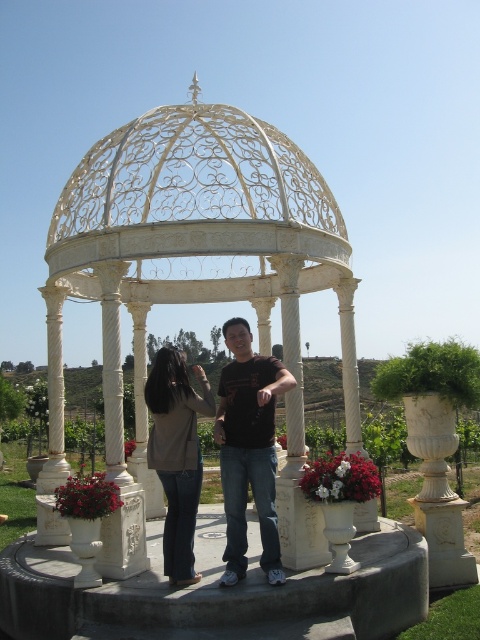
Question: Based on their relative distances, which object is nearer to the white marble gazebo at center?

Choices:
 (A) dark brown t-shirt at center
 (B) matte beige jacket at center

Answer: (A)

Question: Does white marble gazebo at center appear on the left side of matte beige jacket at center?

Choices:
 (A) yes
 (B) no

Answer: (A)

Question: Does white marble gazebo at center appear on the right side of matte beige jacket at center?

Choices:
 (A) no
 (B) yes

Answer: (A)

Question: Which point appears closest to the camera in this image?

Choices:
 (A) (288, 436)
 (B) (179, 349)

Answer: (A)

Question: Which object appears farthest from the camera in this image?

Choices:
 (A) dark brown t-shirt at center
 (B) white marble gazebo at center

Answer: (B)

Question: Can you confirm if white marble gazebo at center is bigger than dark brown t-shirt at center?

Choices:
 (A) yes
 (B) no

Answer: (A)